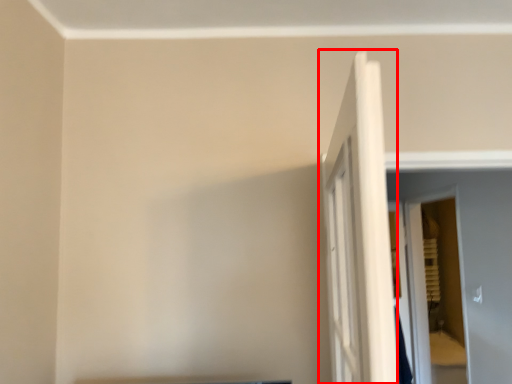
Question: Observing the image, what is the correct spatial positioning of door (annotated by the red box) in reference to screen door?

Choices:
 (A) left
 (B) right

Answer: (A)